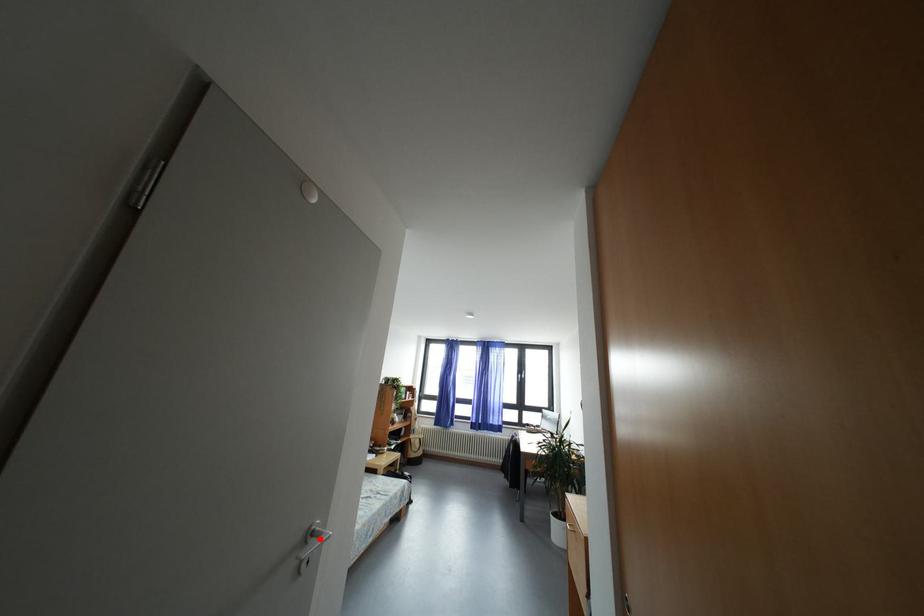
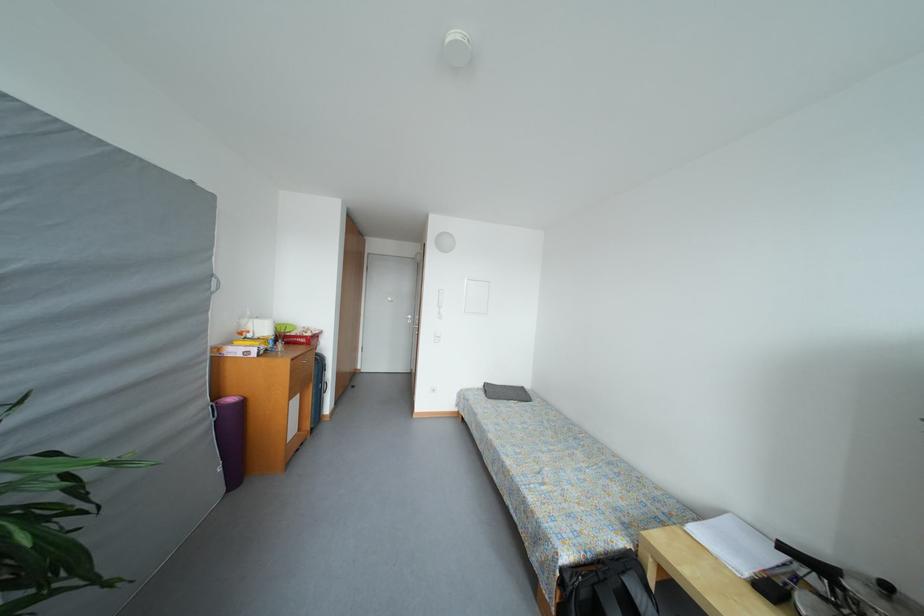
Question: I am providing you with two images of the same scene from different viewpoints. A red point is marked on the first image. Can you still see the location of the red point in image 2?

Choices:
 (A) Yes
 (B) No

Answer: (B)